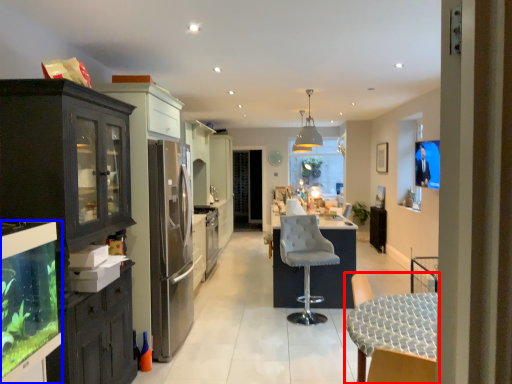
Question: Which object is closer to the camera taking this photo, chair (highlighted by a red box) or cabinetry (highlighted by a blue box)?

Choices:
 (A) chair
 (B) cabinetry

Answer: (B)